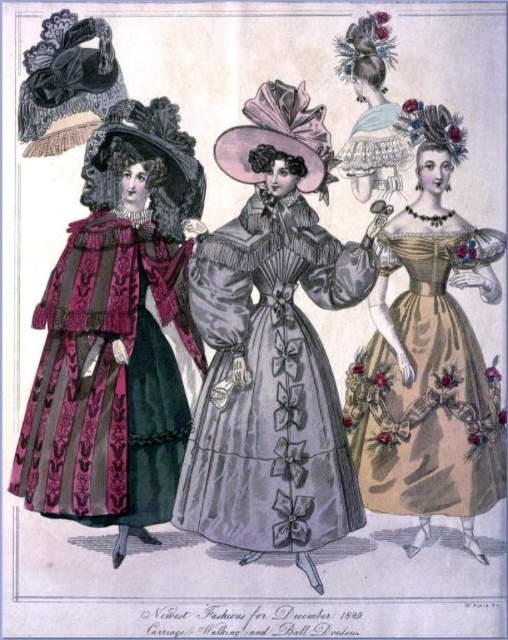
Does velvet-like burgundy dress at left have a smaller size compared to silvery satin dress at center?

Incorrect, velvet-like burgundy dress at left is not smaller in size than silvery satin dress at center.

Who is more forward, (144, 131) or (302, 452)?

Point (302, 452)

At what (x,y) coordinates should I click in order to perform the action: click on velvet-like burgundy dress at left. Please return your answer as a coordinate pair (x, y). The width and height of the screenshot is (508, 640). Looking at the image, I should click on (117, 333).

Between matte gold dress at right and matte silver tiara at upper center, which one appears on the left side from the viewer's perspective?

matte silver tiara at upper center is more to the left.

Between matte gold dress at right and matte silver tiara at upper center, which one has less height?

With less height is matte silver tiara at upper center.

You are a GUI agent. You are given a task and a screenshot of the screen. Output one action in this format:
    pyautogui.click(x=<x>, y=<y>)
    Task: Click on the matte gold dress at right
    
    Given the screenshot: What is the action you would take?
    pyautogui.click(x=428, y=387)

How far apart are silvery satin dress at center and matte gold dress at right?

silvery satin dress at center is 35.14 inches from matte gold dress at right.

Does silvery satin dress at center appear under matte gold dress at right?

Incorrect, silvery satin dress at center is not positioned below matte gold dress at right.

Is point (299, 330) positioned behind point (439, 333)?

No, (299, 330) is closer to viewer.

At what (x,y) coordinates should I click in order to perform the action: click on silvery satin dress at center. Please return your answer as a coordinate pair (x, y). Image resolution: width=508 pixels, height=640 pixels. Looking at the image, I should click on (269, 384).